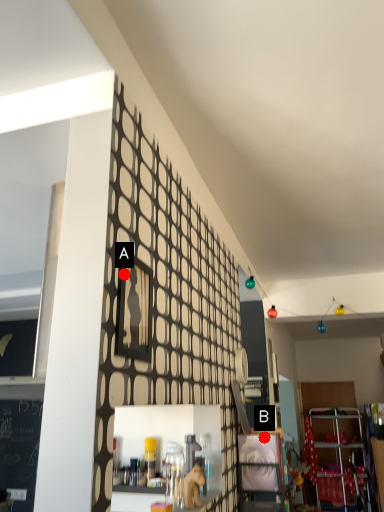
Question: Two points are circled on the image, labeled by A and B beside each circle. Which point is farther from the camera taking this photo?

Choices:
 (A) A is further
 (B) B is further

Answer: (B)